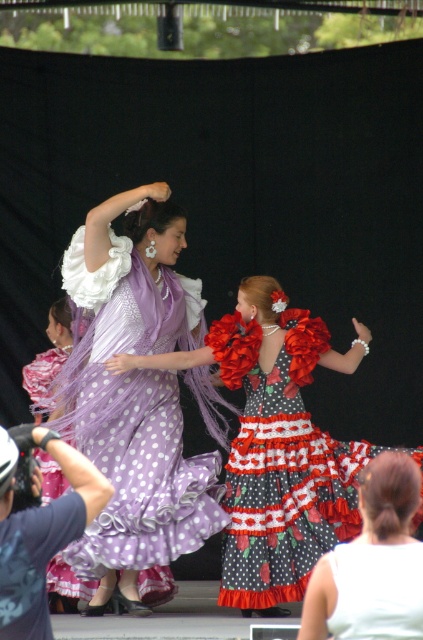
Is red polka dot fabric dress at center shorter than polka dot fabric dress at center?

No.

Does red polka dot fabric dress at center appear under polka dot fabric dress at center?

Incorrect, red polka dot fabric dress at center is not positioned below polka dot fabric dress at center.

Which is behind, point (327, 445) or point (367, 614)?

The point (327, 445) is more distant.

Locate an element on the screen. red polka dot fabric dress at center is located at coordinates (280, 467).

The image size is (423, 640). Find the location of `lavender tulle dress at center`. lavender tulle dress at center is located at coordinates (134, 413).

Who is lower down, lavender tulle dress at center or red polka dot fabric dress at center?

red polka dot fabric dress at center

What do you see at coordinates (134, 413) in the screenshot?
I see `lavender tulle dress at center` at bounding box center [134, 413].

You are a GUI agent. You are given a task and a screenshot of the screen. Output one action in this format:
    pyautogui.click(x=<x>, y=<y>)
    Task: Click on the lavender tulle dress at center
    
    Given the screenshot: What is the action you would take?
    pyautogui.click(x=134, y=413)

Which is in front, point (206, 513) or point (392, 600)?

Point (392, 600)

Which is in front, point (167, 552) or point (387, 627)?

Point (387, 627) is in front.

Where is `lavender tulle dress at center`? The width and height of the screenshot is (423, 640). lavender tulle dress at center is located at coordinates (134, 413).